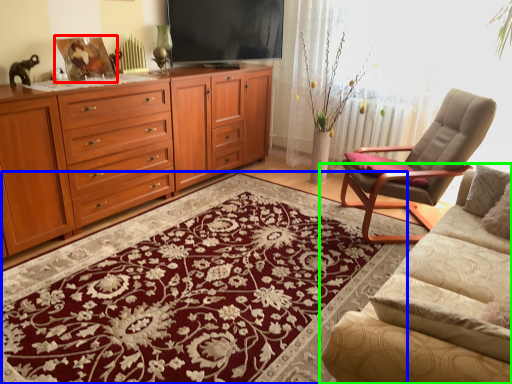
Question: Estimate the real-world distances between objects in this image. Which object is farther from picture frame (highlighted by a red box), mat (highlighted by a blue box) or studio couch (highlighted by a green box)?

Choices:
 (A) mat
 (B) studio couch

Answer: (B)